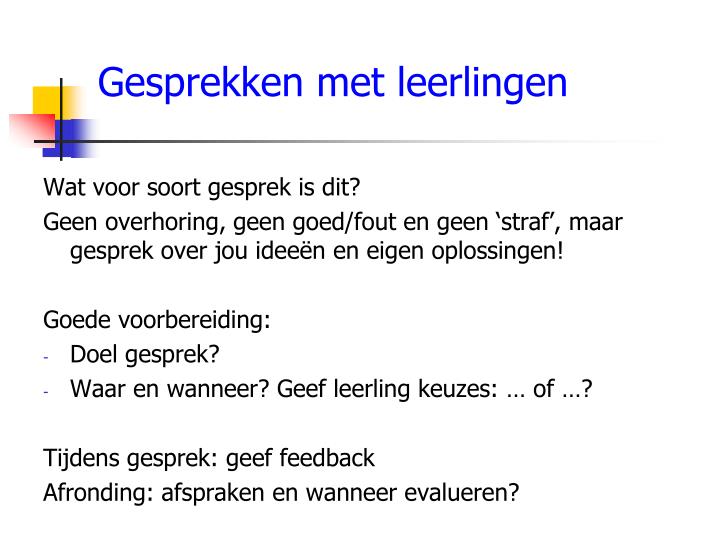
Locate an element on the screen. The width and height of the screenshot is (720, 540). corner is located at coordinates (84, 516).